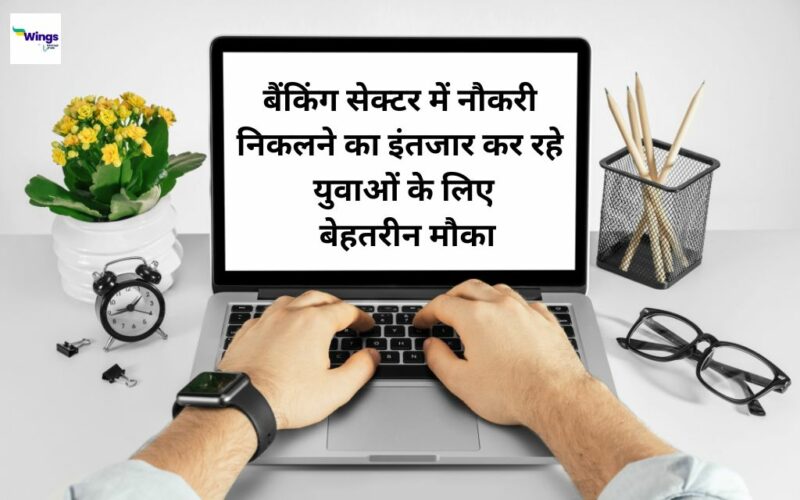
The image size is (800, 500). Identify the location of white plant pot. (93, 253).